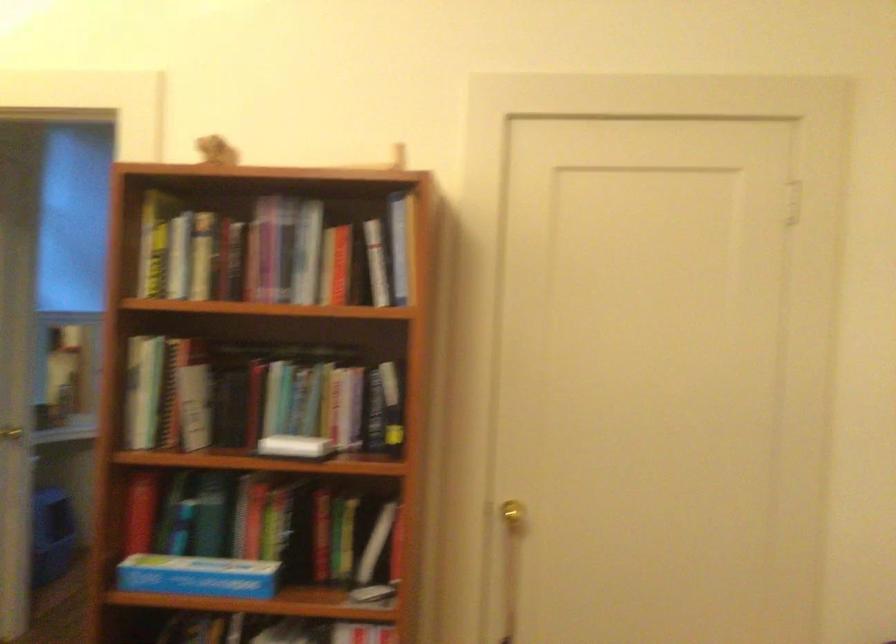
What do you see at coordinates (11, 433) in the screenshot? I see `a silver door knob` at bounding box center [11, 433].